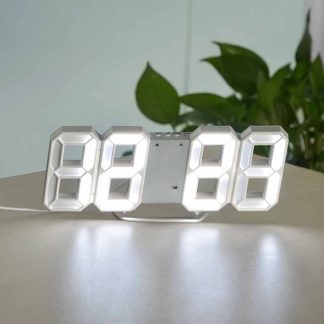
Where is `cord`? The height and width of the screenshot is (324, 324). cord is located at coordinates (21, 208).